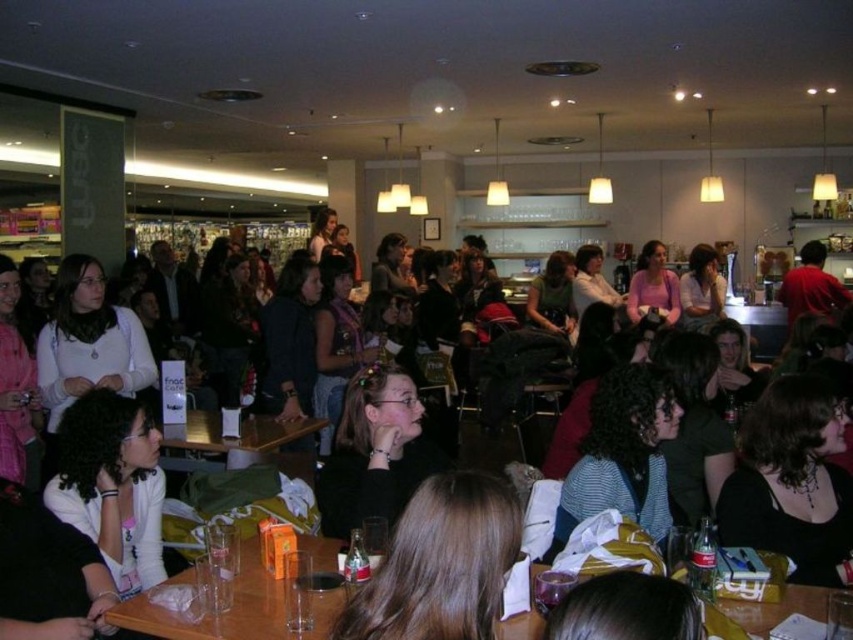
Is point (131, 625) farther from viewer compared to point (265, 440)?

No, it is in front of (265, 440).

Does clear plastic cups at lower center come behind wooden table at center?

No.

Which is behind, point (308, 636) or point (305, 424)?

The point (305, 424) is more distant.

You are a GUI agent. You are given a task and a screenshot of the screen. Output one action in this format:
    pyautogui.click(x=<x>, y=<y>)
    Task: Click on the clear plastic cups at lower center
    Image resolution: width=853 pixels, height=640 pixels.
    Given the screenshot: What is the action you would take?
    pyautogui.click(x=234, y=609)

Is striped fabric shirt at center below wooden table at center?

No.

Can you confirm if striped fabric shirt at center is taller than wooden table at center?

Correct, striped fabric shirt at center is much taller as wooden table at center.

Is point (665, 417) in front of point (256, 419)?

Yes.

This screenshot has height=640, width=853. Find the location of `striped fabric shirt at center`. striped fabric shirt at center is located at coordinates (622, 454).

The image size is (853, 640). I want to click on brown hair at center, so click(x=440, y=563).

Where is `brown hair at center`? Image resolution: width=853 pixels, height=640 pixels. brown hair at center is located at coordinates (440, 563).